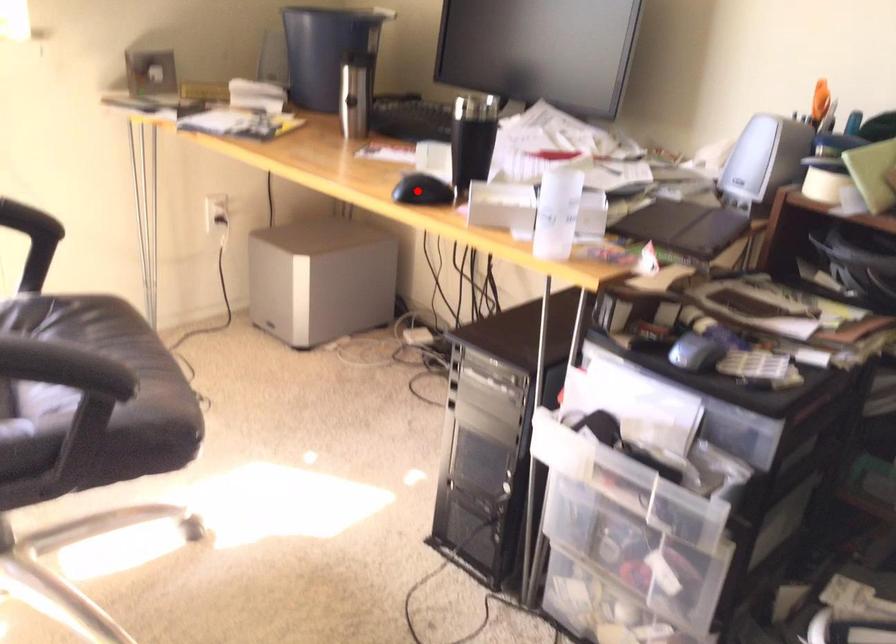
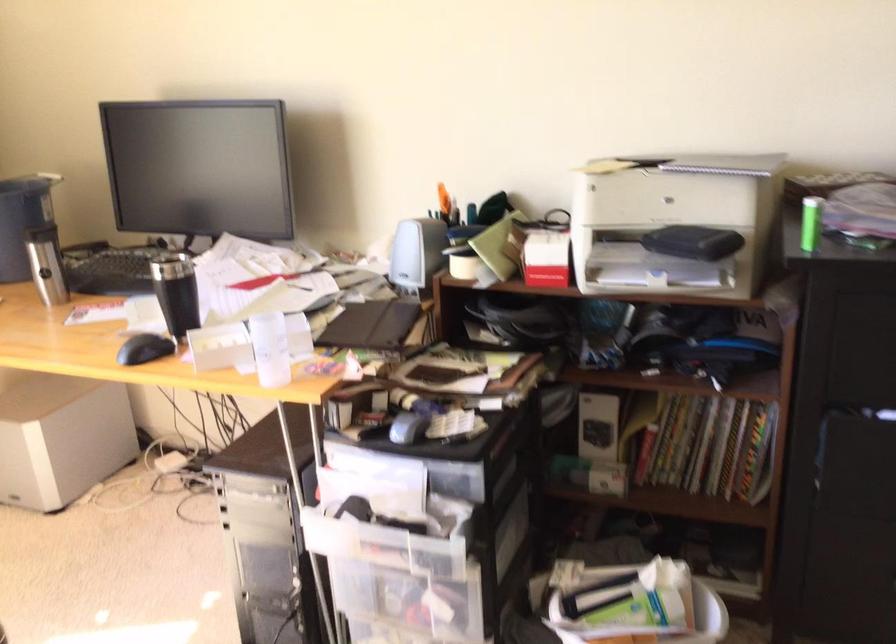
In the second image, find the point that corresponds to the highlighted location in the first image.

(143, 348)